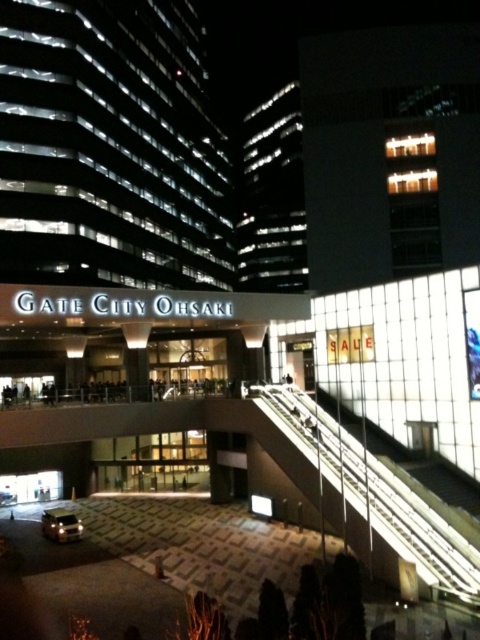
Question: Can you confirm if transparent glass escalator at center is positioned to the right of shiny silver suv at lower left?

Choices:
 (A) no
 (B) yes

Answer: (B)

Question: Does transparent glass escalator at center appear over shiny silver suv at lower left?

Choices:
 (A) yes
 (B) no

Answer: (A)

Question: Which of the following is the farthest from the observer?

Choices:
 (A) click(x=319, y=410)
 (B) click(x=55, y=509)

Answer: (A)

Question: Considering the relative positions of transparent glass escalator at center and shiny silver suv at lower left in the image provided, where is transparent glass escalator at center located with respect to shiny silver suv at lower left?

Choices:
 (A) above
 (B) below

Answer: (A)

Question: Which point appears closest to the camera in this image?

Choices:
 (A) (82, 524)
 (B) (365, 493)

Answer: (B)